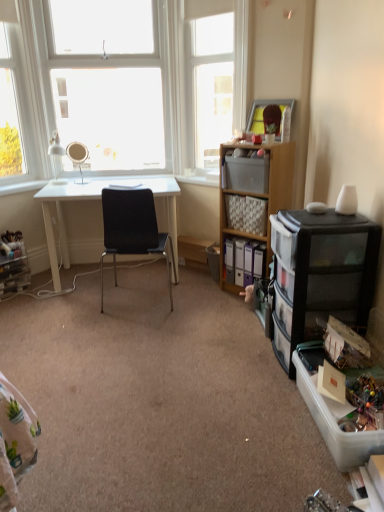
What are the coordinates of `vacant space in front of matte silver mirror at upper left` in the screenshot? It's located at (77, 186).